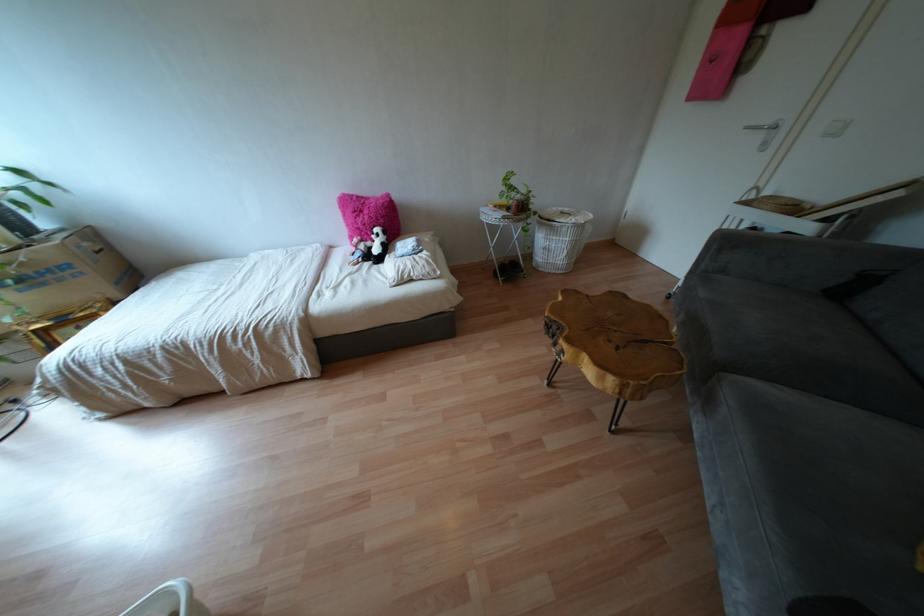
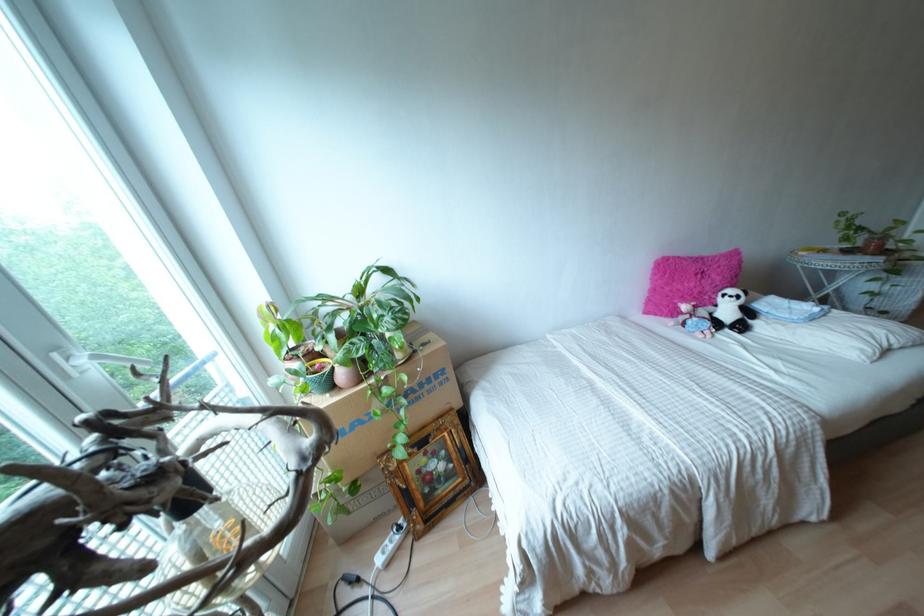
Question: What movement of the cameraman would produce the second image?

Choices:
 (A) Left
 (B) Right
 (C) Forward
 (D) Backward

Answer: (A)